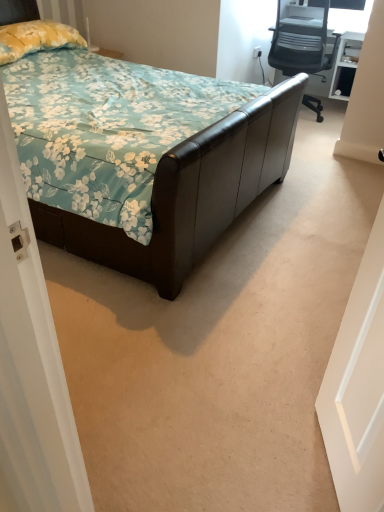
Identify the location of free space below white matte door at right (from a real-world perspective). (319, 462).